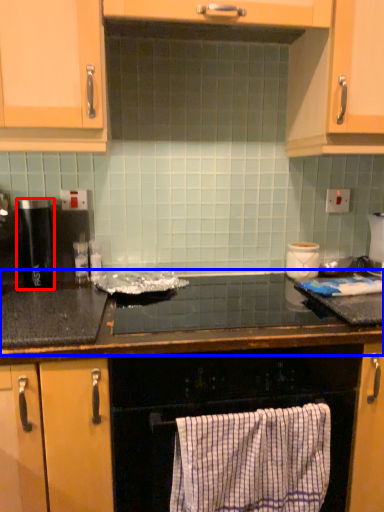
Question: Among these objects, which one is farthest to the camera, kitchen appliance (highlighted by a red box) or countertop (highlighted by a blue box)?

Choices:
 (A) kitchen appliance
 (B) countertop

Answer: (A)